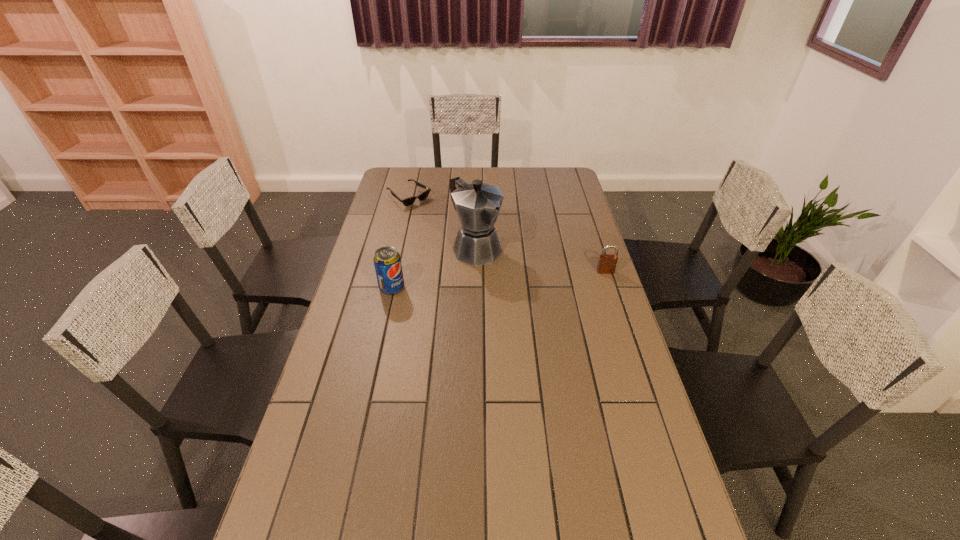
At what (x,y) coordinates should I click in order to perform the action: click on object that is at the far left corner. Please return your answer as a coordinate pair (x, y). The image size is (960, 540). Looking at the image, I should click on (408, 201).

Locate an element on the screen. Image resolution: width=960 pixels, height=540 pixels. free region at the far edge of the desktop is located at coordinates (509, 191).

Image resolution: width=960 pixels, height=540 pixels. I want to click on free region at the near edge, so [384, 509].

In order to click on free point at the left edge in this screenshot , I will do `click(361, 269)`.

I want to click on free space at the right edge of the desktop, so click(659, 466).

Identify the location of free region at the far right corner of the desktop. (563, 192).

What are the coordinates of `vacant area between the third tallest object and the third shortest object` in the screenshot? It's located at (498, 280).

This screenshot has height=540, width=960. What are the coordinates of `empty space that is in between the nearest object and the second object from right to left` in the screenshot? It's located at (434, 268).

At what (x,y) coordinates should I click in order to perform the action: click on free area in between the padlock and the coffeepot. Please return your answer as a coordinate pair (x, y). This screenshot has width=960, height=540. Looking at the image, I should click on (541, 260).

You are a GUI agent. You are given a task and a screenshot of the screen. Output one action in this format:
    pyautogui.click(x=<x>, y=<y>)
    Task: Click on the empty space between the second tallest object and the second shortest object
    This screenshot has width=960, height=540.
    Given the screenshot: What is the action you would take?
    pyautogui.click(x=498, y=280)